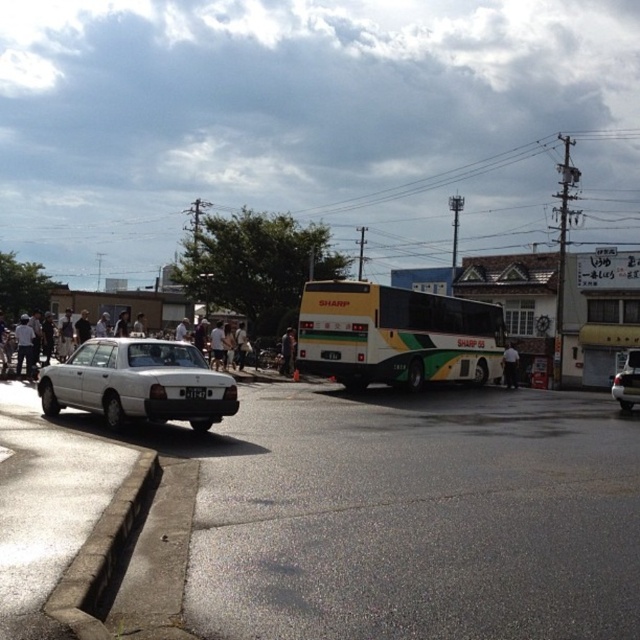
Does point (97, 628) lie behind point (636, 376)?

No, (97, 628) is closer to viewer.

Can you confirm if concrete at lower left is taller than satin silver sedan at lower right?

Incorrect, concrete at lower left's height is not larger of satin silver sedan at lower right's.

Is point (74, 625) positioned before point (634, 371)?

Yes, it is.

Where is `concrete at lower left`? The width and height of the screenshot is (640, 640). concrete at lower left is located at coordinates (102, 554).

At what (x,y) coordinates should I click in order to perform the action: click on concrete at lower left. Please return your answer as a coordinate pair (x, y). Looking at the image, I should click on (102, 554).

Does point (120, 564) come in front of point (188, 392)?

That is True.

Which is behind, point (116, 579) or point (202, 394)?

The point (202, 394) is behind.

Locate an element on the screen. concrete at lower left is located at coordinates (102, 554).

Is yellow-green painted bus at center wider than white fabric shirt at center-right?

Yes.

Locate an element on the screen. yellow-green painted bus at center is located at coordinates (396, 336).

Is point (424, 365) positioned after point (515, 387)?

No, it is not.

Image resolution: width=640 pixels, height=640 pixels. In order to click on yellow-green painted bus at center in this screenshot , I will do `click(396, 336)`.